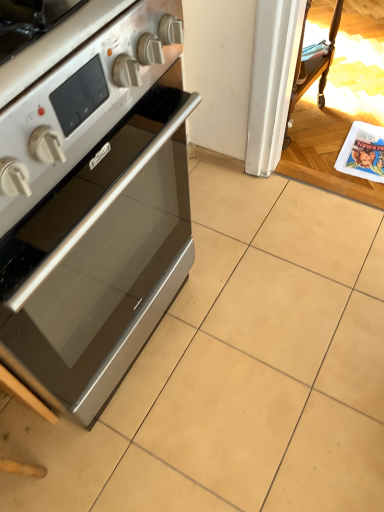
Find the location of a particular element. This screenshot has width=384, height=512. empty space that is ontop of white glossy magazine at right (from a real-world perspective) is located at coordinates (362, 148).